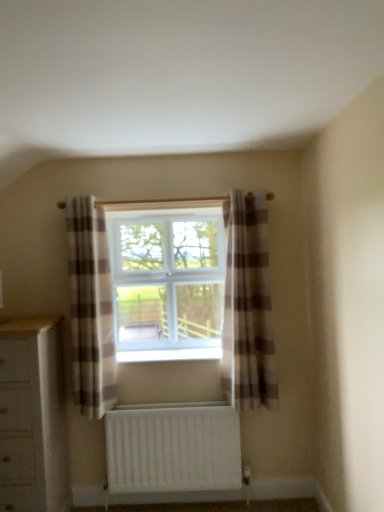
The height and width of the screenshot is (512, 384). What do you see at coordinates (33, 418) in the screenshot?
I see `white wood chest of drawers at lower left` at bounding box center [33, 418].

Where is `white matte radiator at lower center`? This screenshot has width=384, height=512. white matte radiator at lower center is located at coordinates (173, 448).

Measure the distance between point (x=81, y=279) and camera.

A distance of 2.65 meters exists between point (x=81, y=279) and camera.

What are the coordinates of `white wood chest of drawers at lower left` in the screenshot? It's located at pyautogui.click(x=33, y=418).

Considering the positions of point (139, 358) and point (234, 375), is point (139, 358) closer or farther from the camera than point (234, 375)?

Point (139, 358) is farther from the camera than point (234, 375).

Which of these two, white plastic window sill at center or plaid fabric curtain at center, which is the first curtain from right to left, stands taller?

With more height is plaid fabric curtain at center, which is the first curtain from right to left.

Can you confirm if white plastic window sill at center is thinner than plaid fabric curtain at center, arranged as the second curtain when viewed from the left?

In fact, white plastic window sill at center might be wider than plaid fabric curtain at center, arranged as the second curtain when viewed from the left.

From a real-world perspective, is white wood chest of drawers at lower left on top of white plastic window at center?

No, from a real-world perspective, white wood chest of drawers at lower left is not over white plastic window at center

How different are the orientations of white wood chest of drawers at lower left and white plastic window at center in degrees?

0.0034 degrees separate the facing orientations of white wood chest of drawers at lower left and white plastic window at center.

Is white wood chest of drawers at lower left behind white plastic window at center?

No, the depth of white wood chest of drawers at lower left is less than that of white plastic window at center.

Is white wood chest of drawers at lower left facing towards white plastic window at center?

No, white wood chest of drawers at lower left is not oriented towards white plastic window at center.

Between white plastic window sill at center and plaid fabric curtain at center, placed as the 2th curtain when sorted from right to left, which one appears on the left side from the viewer's perspective?

Positioned to the left is plaid fabric curtain at center, placed as the 2th curtain when sorted from right to left.

Is white plastic window sill at center looking in the opposite direction of plaid fabric curtain at center, placed as the 2th curtain when sorted from right to left?

white plastic window sill at center is not turned away from plaid fabric curtain at center, placed as the 2th curtain when sorted from right to left.

Does white plastic window sill at center have a lesser height compared to plaid fabric curtain at center, placed as the 2th curtain when sorted from right to left?

Correct, white plastic window sill at center is not as tall as plaid fabric curtain at center, placed as the 2th curtain when sorted from right to left.

Based on their positions, is plaid fabric curtain at center, marked as the 1th curtain in a left-to-right arrangement, located to the left or right of white wood chest of drawers at lower left?

plaid fabric curtain at center, marked as the 1th curtain in a left-to-right arrangement, is positioned on white wood chest of drawers at lower left's right side.

Does plaid fabric curtain at center, marked as the 1th curtain in a left-to-right arrangement, touch white wood chest of drawers at lower left?

No, plaid fabric curtain at center, marked as the 1th curtain in a left-to-right arrangement, is not touching white wood chest of drawers at lower left.

Which point is more distant from viewer, (x=74, y=253) or (x=65, y=492)?

Point (x=65, y=492)

Is white plastic window sill at center closer to camera compared to white wood chest of drawers at lower left?

No, white plastic window sill at center is further to the viewer.

How much distance is there between white plastic window sill at center and white wood chest of drawers at lower left?

The distance of white plastic window sill at center from white wood chest of drawers at lower left is 28.37 inches.

Which is farther, (162, 358) or (31, 441)?

The point (162, 358) is farther from the camera.

Is white plastic window sill at center looking in the opposite direction of white wood chest of drawers at lower left?

No, white plastic window sill at center's orientation is not away from white wood chest of drawers at lower left.

From the image's perspective, relative to white plastic window at center, is white plastic window sill at center above or below?

Clearly, from the image's perspective, white plastic window sill at center is below white plastic window at center.

Can we say white plastic window sill at center lies outside white plastic window at center?

Absolutely, white plastic window sill at center is external to white plastic window at center.

Is white plastic window sill at center further to camera compared to white plastic window at center?

No, the depth of white plastic window sill at center is less than that of white plastic window at center.

Is point (143, 358) positioned after point (135, 214)?

No, it is not.

From the picture: Between white matte radiator at lower center and plaid fabric curtain at center, placed as the 2th curtain when sorted from right to left, which one has larger size?

plaid fabric curtain at center, placed as the 2th curtain when sorted from right to left, is bigger.

From a real-world perspective, between white matte radiator at lower center and plaid fabric curtain at center, marked as the 1th curtain in a left-to-right arrangement, who is vertically higher?

In real-world perspective, plaid fabric curtain at center, marked as the 1th curtain in a left-to-right arrangement, is above.

Can you tell me how much white matte radiator at lower center and plaid fabric curtain at center, placed as the 2th curtain when sorted from right to left, differ in facing direction?

white matte radiator at lower center and plaid fabric curtain at center, placed as the 2th curtain when sorted from right to left, are facing 0.00827 degrees away from each other.

Who is taller, white matte radiator at lower center or plaid fabric curtain at center, placed as the 2th curtain when sorted from right to left?

With more height is plaid fabric curtain at center, placed as the 2th curtain when sorted from right to left.

Locate an element on the screen. This screenshot has width=384, height=512. window sill on the left side of plaid fabric curtain at center, which is the first curtain from right to left is located at coordinates (170, 354).

This screenshot has width=384, height=512. I want to click on window above the white wood chest of drawers at lower left (from the image's perspective), so click(167, 280).

Estimate the real-world distances between objects in this image. Which object is further from white wood chest of drawers at lower left, white plastic window at center or plaid fabric curtain at center, marked as the 1th curtain in a left-to-right arrangement?

Among the two, white plastic window at center is located further to white wood chest of drawers at lower left.

Consider the image. Which object lies further to the anchor point white plastic window sill at center, plaid fabric curtain at center, marked as the 1th curtain in a left-to-right arrangement, or white matte radiator at lower center?

white matte radiator at lower center is positioned further to the anchor white plastic window sill at center.

Estimate the real-world distances between objects in this image. Which object is further from white plastic window at center, white wood chest of drawers at lower left or white matte radiator at lower center?

white wood chest of drawers at lower left is further to white plastic window at center.

Looking at the image, which one is located closer to plaid fabric curtain at center, arranged as the second curtain when viewed from the left, white matte radiator at lower center or white plastic window at center?

Based on the image, white plastic window at center appears to be nearer to plaid fabric curtain at center, arranged as the second curtain when viewed from the left.

Considering their positions, is white matte radiator at lower center positioned further to plaid fabric curtain at center, marked as the 1th curtain in a left-to-right arrangement, than plaid fabric curtain at center, arranged as the second curtain when viewed from the left?

The object further to plaid fabric curtain at center, marked as the 1th curtain in a left-to-right arrangement, is plaid fabric curtain at center, arranged as the second curtain when viewed from the left.

From the image, which object appears to be nearer to white plastic window at center, white matte radiator at lower center or white plastic window sill at center?

white plastic window sill at center.

Based on their spatial positions, is plaid fabric curtain at center, arranged as the second curtain when viewed from the left, or white plastic window at center closer to white matte radiator at lower center?

plaid fabric curtain at center, arranged as the second curtain when viewed from the left.

Estimate the real-world distances between objects in this image. Which object is closer to white plastic window sill at center, white plastic window at center or white matte radiator at lower center?

Among the two, white plastic window at center is located nearer to white plastic window sill at center.

Locate an element on the screen. The width and height of the screenshot is (384, 512). window sill located between plaid fabric curtain at center, placed as the 2th curtain when sorted from right to left, and plaid fabric curtain at center, arranged as the second curtain when viewed from the left, in the left-right direction is located at coordinates (170, 354).

The width and height of the screenshot is (384, 512). Find the location of `window sill between white wood chest of drawers at lower left and white matte radiator at lower center`. window sill between white wood chest of drawers at lower left and white matte radiator at lower center is located at coordinates (170, 354).

I want to click on window sill situated between white wood chest of drawers at lower left and plaid fabric curtain at center, which is the first curtain from right to left, from left to right, so click(170, 354).

This screenshot has height=512, width=384. I want to click on curtain between plaid fabric curtain at center, arranged as the second curtain when viewed from the left, and white matte radiator at lower center, in the vertical direction, so coord(91,308).